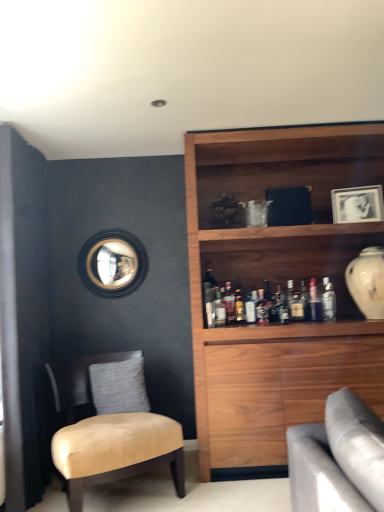
Where is `gray textured pillow at center-left`? gray textured pillow at center-left is located at coordinates (119, 386).

What do you see at coordinates (110, 428) in the screenshot? Image resolution: width=384 pixels, height=512 pixels. I see `tan leather chair at left` at bounding box center [110, 428].

The width and height of the screenshot is (384, 512). Describe the element at coordinates (219, 309) in the screenshot. I see `matte glass bottle at center, placed as the sixth bottle when sorted from right to left` at that location.

Locate an element on the screen. translucent glass bottle at shelf center, the third bottle viewed from the left is located at coordinates (229, 304).

Describe the element at coordinates (357, 204) in the screenshot. I see `black matte picture frame at upper right` at that location.

The image size is (384, 512). I want to click on clear glass bottle at upper right, which is the first bottle from right to left, so click(329, 303).

Does clear glass bottle at upper right, which is the first bottle from right to left, come behind translucent glass bottle at shelf center, acting as the 5th bottle starting from the right?

No, clear glass bottle at upper right, which is the first bottle from right to left, is closer to the viewer.

Does clear glass bottle at upper right, arranged as the seventh bottle when viewed from the left, have a greater height compared to translucent glass bottle at shelf center, the third bottle viewed from the left?

No.

Considering the relative sizes of clear glass bottle at upper right, which is the first bottle from right to left, and translucent glass bottle at shelf center, acting as the 5th bottle starting from the right, in the image provided, is clear glass bottle at upper right, which is the first bottle from right to left, wider than translucent glass bottle at shelf center, acting as the 5th bottle starting from the right,?

No, clear glass bottle at upper right, which is the first bottle from right to left, is not wider than translucent glass bottle at shelf center, acting as the 5th bottle starting from the right.

Is translucent glass bottle at shelf center, the third bottle viewed from the left, not close to matte glass bottle at shelf center?

No, translucent glass bottle at shelf center, the third bottle viewed from the left, is not far away from matte glass bottle at shelf center.

Is translucent glass bottle at shelf center, acting as the 5th bottle starting from the right, closer to the viewer compared to matte glass bottle at shelf center?

No.

Considering the relative positions of translucent glass bottle at shelf center, acting as the 5th bottle starting from the right, and matte glass bottle at shelf center in the image provided, is translucent glass bottle at shelf center, acting as the 5th bottle starting from the right, to the left or to the right of matte glass bottle at shelf center?

Based on their positions, translucent glass bottle at shelf center, acting as the 5th bottle starting from the right, is located to the left of matte glass bottle at shelf center.

Is matte glass bottle at shelf center at the back of translucent glass bottle at shelf center, the third bottle viewed from the left?

No.

In the image, is matte glass bottle at upper right, which is the 3th bottle from right to left, on the left side or the right side of gray textured pillow at center-left?

Based on their positions, matte glass bottle at upper right, which is the 3th bottle from right to left, is located to the right of gray textured pillow at center-left.

Is point (307, 297) more distant than point (135, 357)?

That is True.

From the image's perspective, who appears lower, matte glass bottle at upper right, which is the 3th bottle from right to left, or gray textured pillow at center-left?

gray textured pillow at center-left.

Can you confirm if matte glass bottle at upper right, the fifth bottle positioned from the left, is bigger than gray textured pillow at center-left?

Actually, matte glass bottle at upper right, the fifth bottle positioned from the left, might be smaller than gray textured pillow at center-left.

In the scene shown: Does matte glass bottle at shelf center lie behind matte glass bottle at center, positioned as the second bottle in left-to-right order?

That is True.

Considering the points (297, 315) and (221, 297), which point is in front, point (297, 315) or point (221, 297)?

The point (297, 315) is in front.

How many degrees apart are the facing directions of matte glass bottle at shelf center and matte glass bottle at center, positioned as the second bottle in left-to-right order?

3.03 degrees.

In the scene shown: Would you consider translucent glass bottle at shelf center, acting as the 5th bottle starting from the right, to be distant from matte glass bottle at upper right, which is the 3th bottle from right to left?

That's not correct — translucent glass bottle at shelf center, acting as the 5th bottle starting from the right, is a little close to matte glass bottle at upper right, which is the 3th bottle from right to left.

Looking at their sizes, would you say translucent glass bottle at shelf center, acting as the 5th bottle starting from the right, is wider or thinner than matte glass bottle at upper right, the fifth bottle positioned from the left?

translucent glass bottle at shelf center, acting as the 5th bottle starting from the right, is thinner than matte glass bottle at upper right, the fifth bottle positioned from the left.

Would you say translucent glass bottle at shelf center, acting as the 5th bottle starting from the right, is outside matte glass bottle at upper right, the fifth bottle positioned from the left?

Absolutely, translucent glass bottle at shelf center, acting as the 5th bottle starting from the right, is external to matte glass bottle at upper right, the fifth bottle positioned from the left.

Consider the image. Are tan leather chair at left and satin silver bottle at upper right, positioned as the sixth bottle in left-to-right order, beside each other?

No, tan leather chair at left is not touching satin silver bottle at upper right, positioned as the sixth bottle in left-to-right order.

Is tan leather chair at left spatially inside satin silver bottle at upper right, the 2th bottle viewed from the right, or outside of it?

The correct answer is: outside.

Does point (309, 308) lie behind point (367, 250)?

No, it is in front of (367, 250).

There is a white glossy vase at upper right. Where is `the 4th bottle below it (from a real-world perspective)`? This screenshot has height=512, width=384. the 4th bottle below it (from a real-world perspective) is located at coordinates (305, 301).

Which is behind, matte glass bottle at upper right, the fifth bottle positioned from the left, or white glossy vase at upper right?

Positioned behind is matte glass bottle at upper right, the fifth bottle positioned from the left.

From a real-world perspective, starting from the clear glass bottle at upper right, arranged as the seventh bottle when viewed from the left, which bottle is the 3rd one vertically above it? Please provide its 2D coordinates.

[(229, 304)]

At what (x,y) coordinates should I click in order to perform the action: click on bottle that is the 2nd object to the left of the matte glass bottle at shelf center, starting at the anchor. Please return your answer as a coordinate pair (x, y). Looking at the image, I should click on (229, 304).

Estimate the real-world distances between objects in this image. Which object is closer to matte glass bottle at center, positioned as the second bottle in left-to-right order, black matte picture frame at upper right or satin silver bottle at upper right, the 2th bottle viewed from the right?

satin silver bottle at upper right, the 2th bottle viewed from the right.

Which object lies further to the anchor point matte black mirror at upper left, matte glass bottle at center, placed as the sixth bottle when sorted from right to left, or clear glass bottle at upper right, arranged as the seventh bottle when viewed from the left?

clear glass bottle at upper right, arranged as the seventh bottle when viewed from the left.

Considering their positions, is matte glass bottle at upper right, the fifth bottle positioned from the left, positioned closer to black matte picture frame at upper right than tan leather chair at left?

The object closer to black matte picture frame at upper right is matte glass bottle at upper right, the fifth bottle positioned from the left.

From the image, which object appears to be nearer to matte glass bottle at center, the fourth bottle from the left, translucent glass bottle at shelf center, the third bottle viewed from the left, or tan leather chair at left?

Among the two, translucent glass bottle at shelf center, the third bottle viewed from the left, is located nearer to matte glass bottle at center, the fourth bottle from the left.

Looking at the image, which one is located closer to matte glass bottle at center, placed as the sixth bottle when sorted from right to left, black matte picture frame at upper right or matte black mirror at upper left?

Among the two, matte black mirror at upper left is located nearer to matte glass bottle at center, placed as the sixth bottle when sorted from right to left.

From the image, which object appears to be farther from clear glass bottle at upper right, arranged as the seventh bottle when viewed from the left, matte glass bottle at center, positioned as the second bottle in left-to-right order, or translucent glass bottle at shelf center, acting as the 5th bottle starting from the right?

The object further to clear glass bottle at upper right, arranged as the seventh bottle when viewed from the left, is matte glass bottle at center, positioned as the second bottle in left-to-right order.

From the image, which object appears to be nearer to clear glass bottle at center, the seventh bottle from the right, gray textured pillow at center-left or matte glass bottle at shelf center?

matte glass bottle at shelf center is closer to clear glass bottle at center, the seventh bottle from the right.

Considering their positions, is matte black mirror at upper left positioned further to matte glass bottle at upper right, which is the 3th bottle from right to left, than clear glass bottle at upper right, arranged as the seventh bottle when viewed from the left?

matte black mirror at upper left is positioned further to the anchor matte glass bottle at upper right, which is the 3th bottle from right to left.

Image resolution: width=384 pixels, height=512 pixels. In order to click on picture frame between gray textured pillow at center-left and white glossy vase at upper right from left to right in this screenshot , I will do `click(357, 204)`.

I want to click on pillow situated between matte black mirror at upper left and matte glass bottle at upper right, which is the 3th bottle from right to left, from left to right, so click(119, 386).

Locate an element on the screen. The image size is (384, 512). beverage situated between gray textured pillow at center-left and clear glass bottle at upper right, which is the first bottle from right to left, from left to right is located at coordinates (297, 307).

At what (x,y) coordinates should I click in order to perform the action: click on pillow located between matte black mirror at upper left and matte glass bottle at shelf center in the left-right direction. Please return your answer as a coordinate pair (x, y). Looking at the image, I should click on click(x=119, y=386).